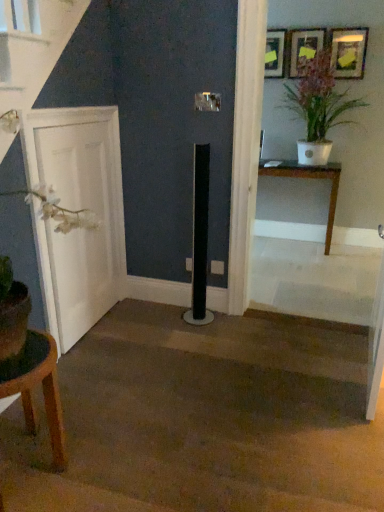
Find the location of a particular element. Image resolution: width=384 pixels, height=512 pixels. vacant space underneath wooden table at right, the first table positioned from the right (from a real-world perspective) is located at coordinates (283, 247).